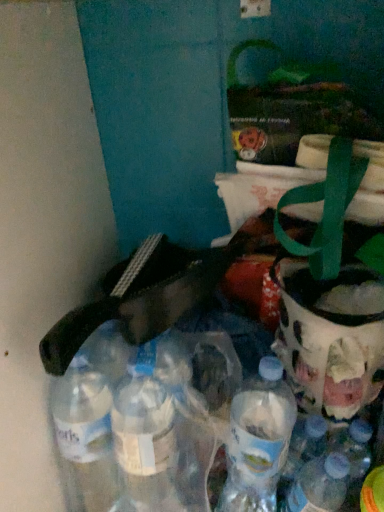
What do you see at coordinates (135, 434) in the screenshot? I see `clear plastic bottles at lower left, the 2th bottle positioned from the right` at bounding box center [135, 434].

Find the location of `translucent glass jar at right`. translucent glass jar at right is located at coordinates click(331, 337).

Considering the sizes of clear plastic bottles at lower left, the first bottle from the left, and translucent glass jar at right in the image, is clear plastic bottles at lower left, the first bottle from the left, wider or thinner than translucent glass jar at right?

Considering their sizes, clear plastic bottles at lower left, the first bottle from the left, looks broader than translucent glass jar at right.

Can you confirm if clear plastic bottles at lower left, the 2th bottle positioned from the right, is positioned to the left of translucent glass jar at right?

Yes.

In order to click on the 1st bottle below the translucent glass jar at right (from a real-world perspective) in this screenshot , I will do click(x=135, y=434).

Does translucent plastic bottle at lower right, the first bottle when ordered from right to left, have a lesser height compared to clear plastic bottles at lower left, the first bottle from the left?

Correct, translucent plastic bottle at lower right, the first bottle when ordered from right to left, is not as tall as clear plastic bottles at lower left, the first bottle from the left.

Is translucent plastic bottle at lower right, the first bottle when ordered from right to left, not near clear plastic bottles at lower left, the first bottle from the left?

No, there isn't a large distance between translucent plastic bottle at lower right, the first bottle when ordered from right to left, and clear plastic bottles at lower left, the first bottle from the left.

Considering the points (310, 466) and (98, 393), which point is in front, point (310, 466) or point (98, 393)?

Positioned in front is point (98, 393).

From the image's perspective, is translucent plastic bottle at lower right, which ranks as the 2th bottle in left-to-right order, located above or below clear plastic bottles at lower left, the first bottle from the left?

Based on their image positions, translucent plastic bottle at lower right, which ranks as the 2th bottle in left-to-right order, is located beneath clear plastic bottles at lower left, the first bottle from the left.

Which is correct: translucent glass jar at right is inside clear plastic bottles at lower left, the 2th bottle positioned from the right, or outside of it?

translucent glass jar at right lies outside clear plastic bottles at lower left, the 2th bottle positioned from the right.

Which of these two, translucent glass jar at right or clear plastic bottles at lower left, the first bottle from the left, is bigger?

clear plastic bottles at lower left, the first bottle from the left.

From a real-world perspective, between translucent glass jar at right and clear plastic bottles at lower left, the 2th bottle positioned from the right, who is vertically lower?

clear plastic bottles at lower left, the 2th bottle positioned from the right, is physically lower.

Is translucent glass jar at right wider than clear plastic bottles at lower left, the first bottle from the left?

In fact, translucent glass jar at right might be narrower than clear plastic bottles at lower left, the first bottle from the left.

Is translucent plastic bottle at lower right, which ranks as the 2th bottle in left-to-right order, bigger than translucent glass jar at right?

Incorrect, translucent plastic bottle at lower right, which ranks as the 2th bottle in left-to-right order, is not larger than translucent glass jar at right.

Is translucent plastic bottle at lower right, the first bottle when ordered from right to left, far from translucent glass jar at right?

No, there isn't a large distance between translucent plastic bottle at lower right, the first bottle when ordered from right to left, and translucent glass jar at right.

How distant is translucent plastic bottle at lower right, the first bottle when ordered from right to left, from translucent glass jar at right?

5.86 inches.

Can you tell me how much translucent plastic bottle at lower right, the first bottle when ordered from right to left, and translucent glass jar at right differ in facing direction?

The angle between the facing direction of translucent plastic bottle at lower right, the first bottle when ordered from right to left, and the facing direction of translucent glass jar at right is 0.255 degrees.

Find the location of `the 1st bottle counting from the left of the translucent glass jar at right`. the 1st bottle counting from the left of the translucent glass jar at right is located at coordinates (319, 485).

Who is more distant, translucent glass jar at right or translucent plastic bottle at lower right, the first bottle when ordered from right to left?

translucent glass jar at right.

Considering the positions of objects translucent glass jar at right and translucent plastic bottle at lower right, the first bottle when ordered from right to left, in the image provided, who is more to the right, translucent glass jar at right or translucent plastic bottle at lower right, the first bottle when ordered from right to left,?

translucent glass jar at right is more to the right.

Is clear plastic bottles at lower left, the first bottle from the left, far away from translucent plastic bottle at lower right, which ranks as the 2th bottle in left-to-right order?

That's not correct — clear plastic bottles at lower left, the first bottle from the left, is a little close to translucent plastic bottle at lower right, which ranks as the 2th bottle in left-to-right order.

Does clear plastic bottles at lower left, the 2th bottle positioned from the right, turn towards translucent plastic bottle at lower right, which ranks as the 2th bottle in left-to-right order?

No, clear plastic bottles at lower left, the 2th bottle positioned from the right, is not aimed at translucent plastic bottle at lower right, which ranks as the 2th bottle in left-to-right order.

Consider the image. Between clear plastic bottles at lower left, the 2th bottle positioned from the right, and translucent plastic bottle at lower right, the first bottle when ordered from right to left, which one is positioned in front?

clear plastic bottles at lower left, the 2th bottle positioned from the right.

The image size is (384, 512). I want to click on the 2nd bottle in front of the translucent glass jar at right, starting your count from the anchor, so pyautogui.click(x=135, y=434).

Where is `bottle above the translucent plastic bottle at lower right, which ranks as the 2th bottle in left-to-right order (from the image's perspective)`? bottle above the translucent plastic bottle at lower right, which ranks as the 2th bottle in left-to-right order (from the image's perspective) is located at coordinates (135, 434).

Estimate the real-world distances between objects in this image. Which object is closer to translucent plastic bottle at lower right, the first bottle when ordered from right to left, clear plastic bottles at lower left, the first bottle from the left, or translucent glass jar at right?

translucent glass jar at right is positioned closer to the anchor translucent plastic bottle at lower right, the first bottle when ordered from right to left.

Which object lies further to the anchor point translucent plastic bottle at lower right, which ranks as the 2th bottle in left-to-right order, translucent glass jar at right or clear plastic bottles at lower left, the 2th bottle positioned from the right?

clear plastic bottles at lower left, the 2th bottle positioned from the right, is further to translucent plastic bottle at lower right, which ranks as the 2th bottle in left-to-right order.

Considering their positions, is translucent glass jar at right positioned closer to clear plastic bottles at lower left, the 2th bottle positioned from the right, than translucent plastic bottle at lower right, the first bottle when ordered from right to left?

translucent glass jar at right lies closer to clear plastic bottles at lower left, the 2th bottle positioned from the right, than the other object.

Looking at the image, which one is located closer to clear plastic bottles at lower left, the 2th bottle positioned from the right, translucent plastic bottle at lower right, which ranks as the 2th bottle in left-to-right order, or translucent glass jar at right?

Among the two, translucent glass jar at right is located nearer to clear plastic bottles at lower left, the 2th bottle positioned from the right.

When comparing their distances from translucent glass jar at right, does translucent plastic bottle at lower right, which ranks as the 2th bottle in left-to-right order, or clear plastic bottles at lower left, the first bottle from the left, seem closer?

translucent plastic bottle at lower right, which ranks as the 2th bottle in left-to-right order, is positioned closer to the anchor translucent glass jar at right.

Considering their positions, is clear plastic bottles at lower left, the first bottle from the left, positioned closer to translucent glass jar at right than translucent plastic bottle at lower right, the first bottle when ordered from right to left?

translucent plastic bottle at lower right, the first bottle when ordered from right to left, is positioned closer to the anchor translucent glass jar at right.

This screenshot has height=512, width=384. What are the coordinates of `bottle between clear plastic bottles at lower left, the 2th bottle positioned from the right, and translucent glass jar at right from left to right` in the screenshot? It's located at (319, 485).